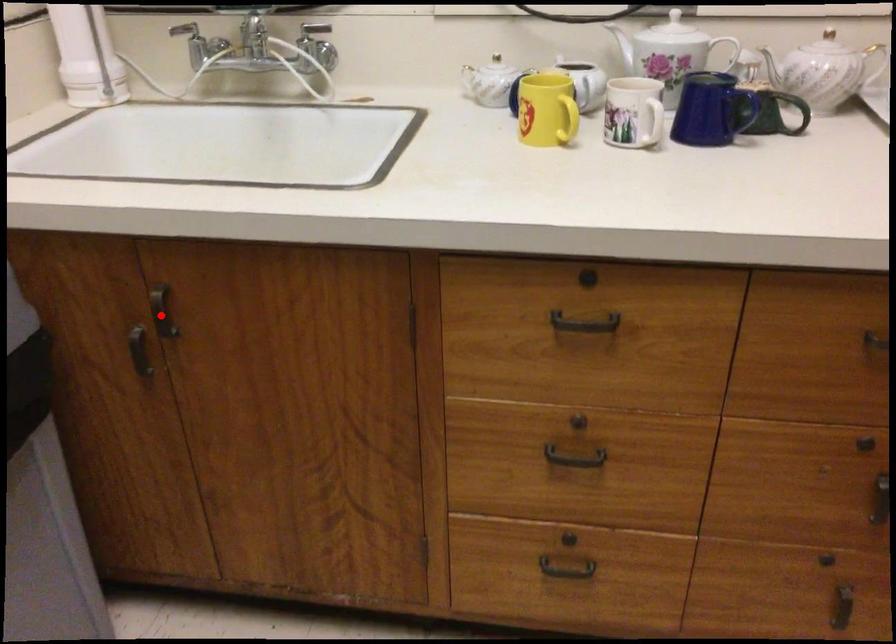
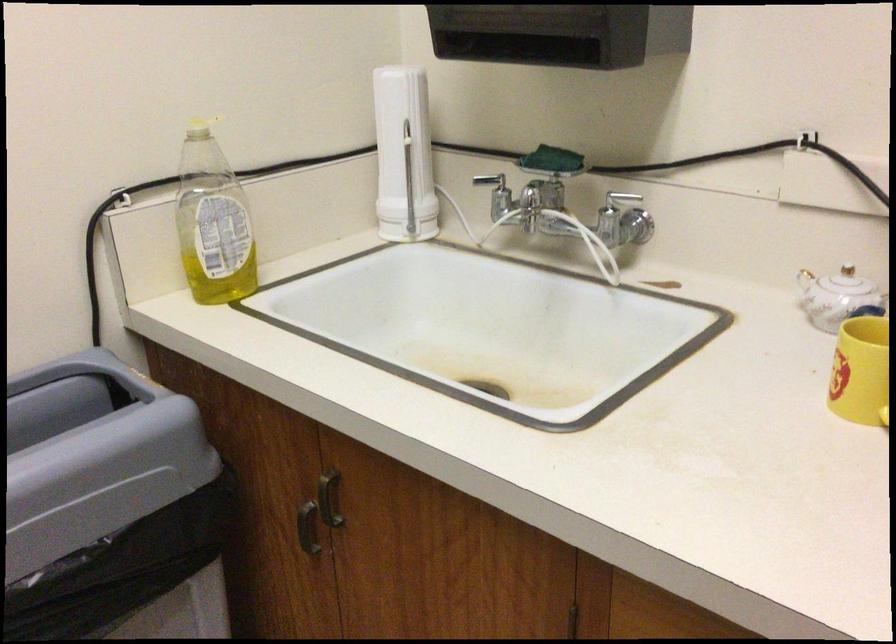
Question: A red point is marked in image1. In image2, is the corresponding 3D point closer to the camera or farther? Reply with the corresponding letter.

Choices:
 (A) The corresponding 3D point is closer.
 (B) The corresponding 3D point is farther.

Answer: (A)